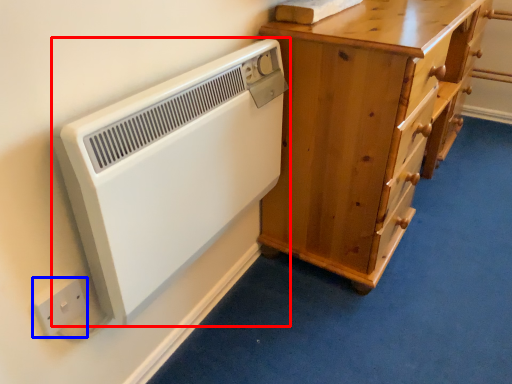
Question: Which point is closer to the camera, home appliance (highlighted by a red box) or electric outlet (highlighted by a blue box)?

Choices:
 (A) home appliance
 (B) electric outlet

Answer: (A)